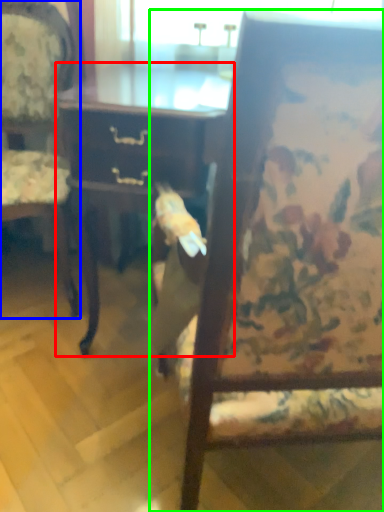
Question: Considering the real-world distances, which object is closest to desk (highlighted by a red box)? chair (highlighted by a blue box) or chair (highlighted by a green box).

Choices:
 (A) chair
 (B) chair

Answer: (A)